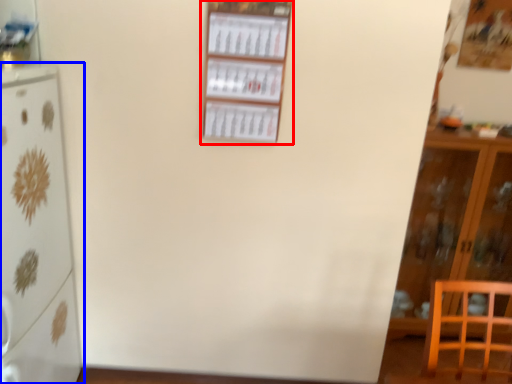
Question: Which object is further to the camera taking this photo, shelf (highlighted by a red box) or refrigerator (highlighted by a blue box)?

Choices:
 (A) shelf
 (B) refrigerator

Answer: (A)